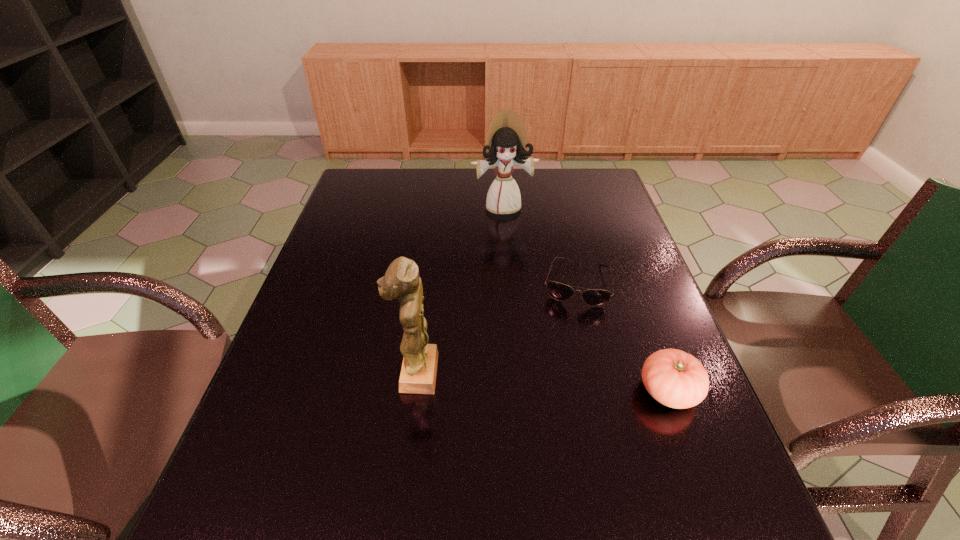
Identify the location of free space between the sunglasses and the figurine. The height and width of the screenshot is (540, 960). (496, 328).

Find the location of a particular element. Image resolution: width=960 pixels, height=540 pixels. vacant area that lies between the third tallest object and the leftmost object is located at coordinates (542, 382).

At what (x,y) coordinates should I click in order to perform the action: click on blank region between the tomato and the second farthest object. Please return your answer as a coordinate pair (x, y). Looking at the image, I should click on (622, 337).

Where is `the second closest object relative to the leftmost object`? Image resolution: width=960 pixels, height=540 pixels. the second closest object relative to the leftmost object is located at coordinates (676, 379).

At what (x,y) coordinates should I click in order to perform the action: click on object that is the closest to the leftmost object. Please return your answer as a coordinate pair (x, y). The image size is (960, 540). Looking at the image, I should click on (593, 297).

The image size is (960, 540). I want to click on free point that satisfies the following two spatial constraints: 1. on the front side of the third tallest object; 2. on the right side of the farthest object, so click(516, 391).

You are a GUI agent. You are given a task and a screenshot of the screen. Output one action in this format:
    pyautogui.click(x=<x>, y=<y>)
    Task: Click on the vacant area that satisfies the following two spatial constraints: 1. on the front side of the sunglasses; 2. on the left side of the farthest object
    
    Given the screenshot: What is the action you would take?
    pyautogui.click(x=509, y=282)